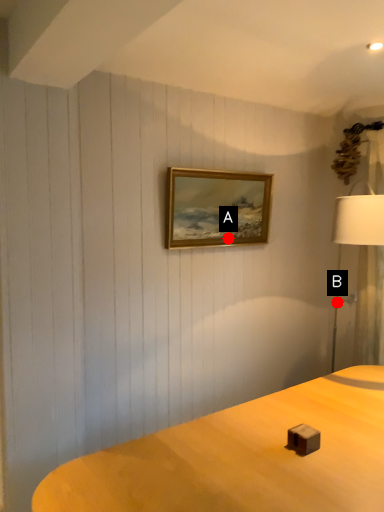
Question: Two points are circled on the image, labeled by A and B beside each circle. Among these points, which one is nearest to the camera?

Choices:
 (A) A is closer
 (B) B is closer

Answer: (A)